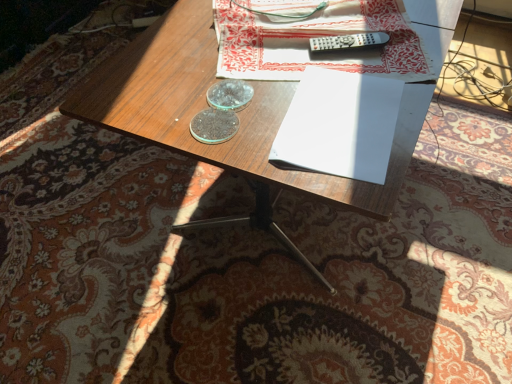
Question: From the image's perspective, is black plastic remote at upper center located beneath white paper at upper center?

Choices:
 (A) no
 (B) yes

Answer: (B)

Question: Does black plastic remote at upper center turn towards white paper at upper center?

Choices:
 (A) no
 (B) yes

Answer: (B)

Question: Does black plastic remote at upper center have a lesser width compared to white paper at upper center?

Choices:
 (A) yes
 (B) no

Answer: (A)

Question: Can you confirm if black plastic remote at upper center is shorter than white paper at upper center?

Choices:
 (A) no
 (B) yes

Answer: (B)

Question: Considering the relative sizes of black plastic remote at upper center and white paper at upper center in the image provided, is black plastic remote at upper center bigger than white paper at upper center?

Choices:
 (A) yes
 (B) no

Answer: (B)

Question: Is black plastic remote at upper center in front of or behind wooden desk at center in the image?

Choices:
 (A) front
 (B) behind

Answer: (B)

Question: From the image's perspective, is black plastic remote at upper center above or below wooden desk at center?

Choices:
 (A) above
 (B) below

Answer: (A)

Question: In terms of height, does black plastic remote at upper center look taller or shorter compared to wooden desk at center?

Choices:
 (A) short
 (B) tall

Answer: (A)

Question: From a real-world perspective, is black plastic remote at upper center above or below wooden desk at center?

Choices:
 (A) above
 (B) below

Answer: (A)

Question: From their relative heights in the image, would you say white paper at center is taller or shorter than black plastic remote at upper center?

Choices:
 (A) short
 (B) tall

Answer: (A)

Question: Based on their sizes in the image, would you say white paper at center is bigger or smaller than black plastic remote at upper center?

Choices:
 (A) big
 (B) small

Answer: (A)

Question: From a real-world perspective, is white paper at center physically located above or below black plastic remote at upper center?

Choices:
 (A) below
 (B) above

Answer: (A)

Question: Does point (311, 145) appear closer or farther from the camera than point (369, 41)?

Choices:
 (A) closer
 (B) farther

Answer: (A)

Question: In terms of height, does wooden desk at center look taller or shorter compared to white paper at upper center?

Choices:
 (A) tall
 (B) short

Answer: (A)

Question: Considering the positions of wooden desk at center and white paper at upper center in the image, is wooden desk at center wider or thinner than white paper at upper center?

Choices:
 (A) wide
 (B) thin

Answer: (A)